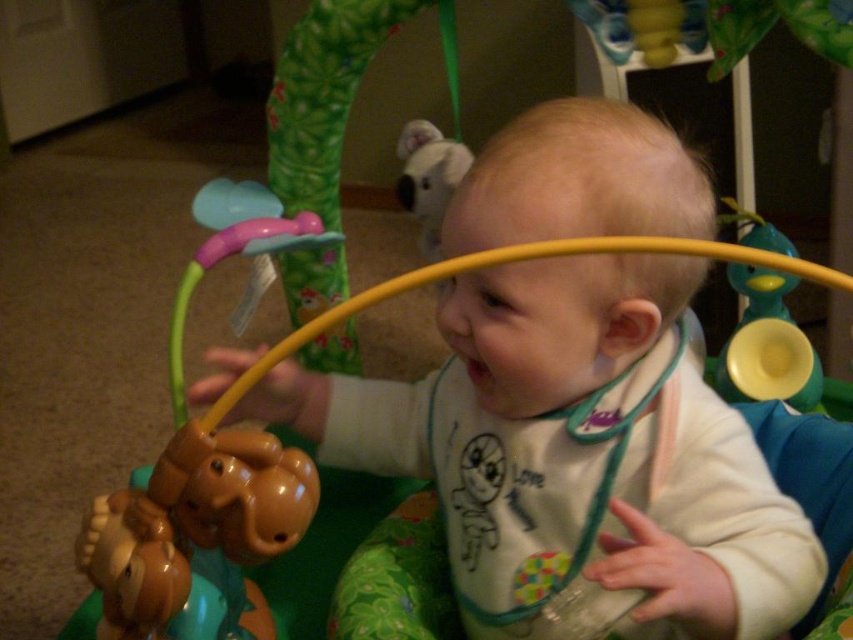
Question: Can you confirm if white matte bib at center is positioned to the left of fluffy white plush at upper center?

Choices:
 (A) no
 (B) yes

Answer: (A)

Question: Among these points, which one is nearest to the camera?

Choices:
 (A) (434, 195)
 (B) (450, 532)

Answer: (B)

Question: Is white matte bib at center positioned before fluffy white plush at upper center?

Choices:
 (A) yes
 (B) no

Answer: (A)

Question: Can you confirm if white matte bib at center is positioned above fluffy white plush at upper center?

Choices:
 (A) no
 (B) yes

Answer: (A)

Question: Among these objects, which one is farthest from the camera?

Choices:
 (A) fluffy white plush at upper center
 (B) white matte bib at center

Answer: (A)